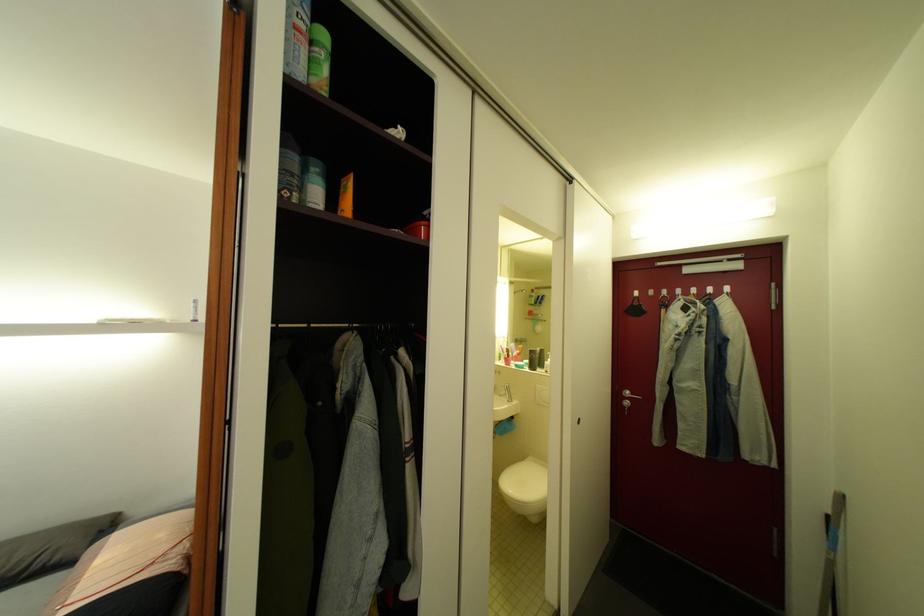
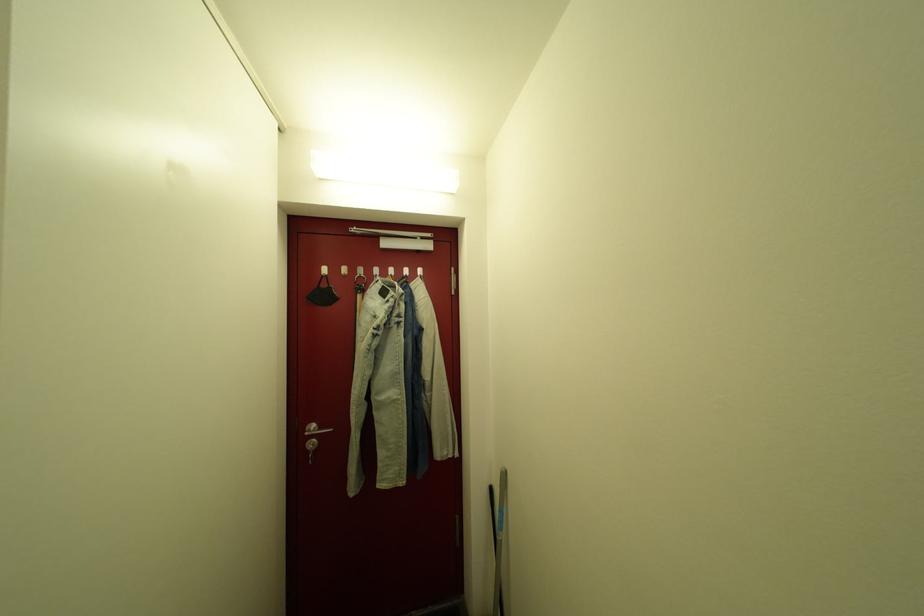
Question: How did the camera likely rotate?

Choices:
 (A) Left
 (B) Right
 (C) Up
 (D) Down

Answer: (B)